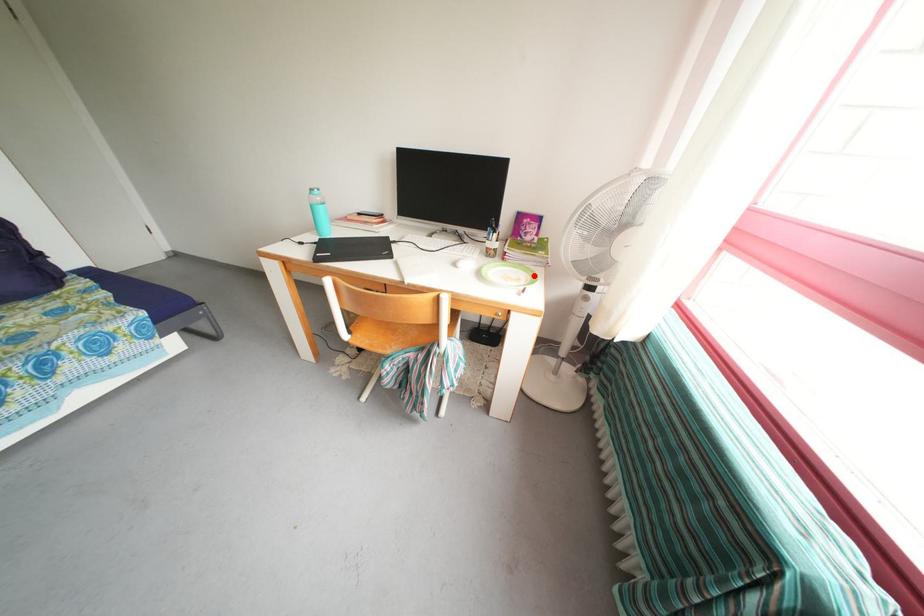
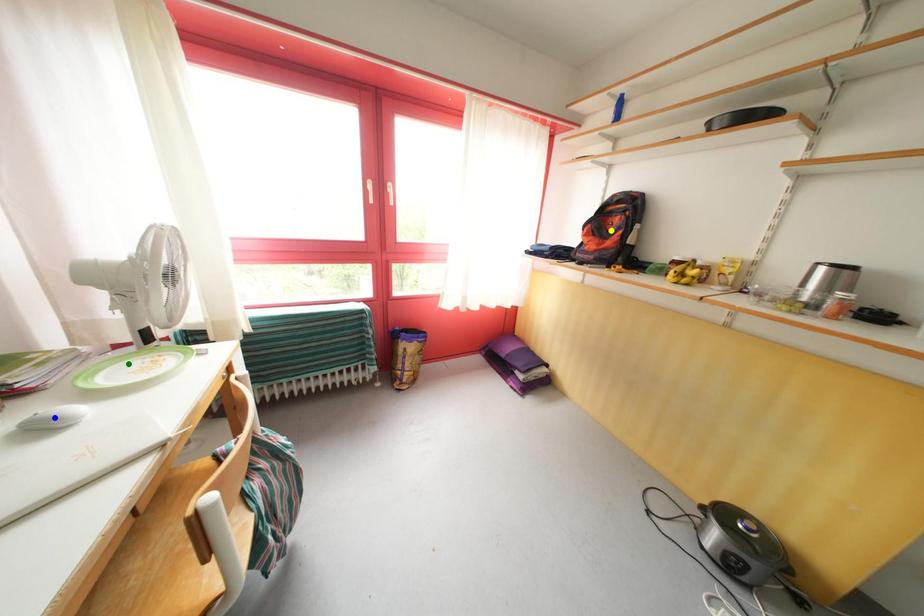
Question: I am providing you with two images of the same scene from different viewpoints. A red point is marked on the first image. You are given multiple points on the second image. Which point in image 2 is actually the same real-world point as the red point in image 1?

Choices:
 (A) green point
 (B) yellow point
 (C) blue point

Answer: (A)